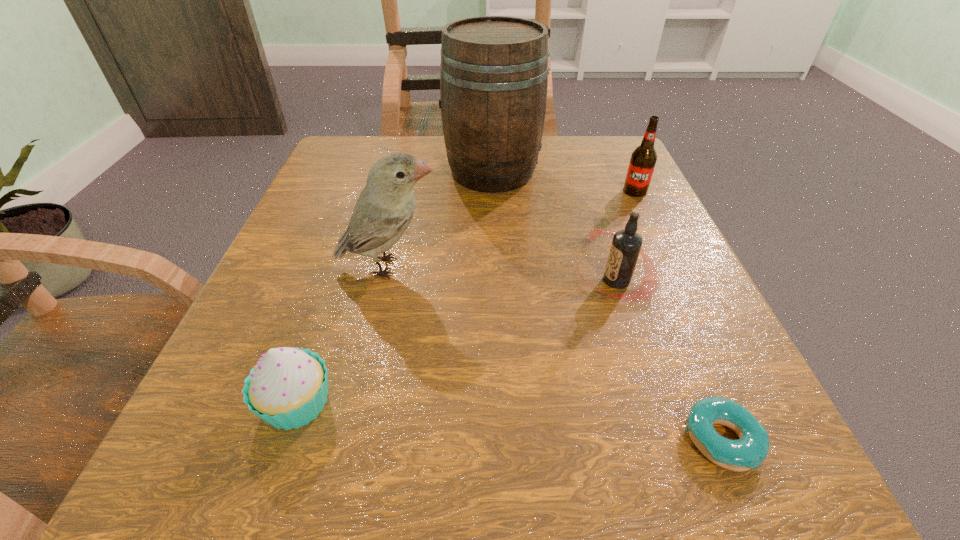
This screenshot has height=540, width=960. What are the coordinates of `free spot between the right root beer and the bird` in the screenshot? It's located at (512, 229).

At what (x,y) coordinates should I click in order to perform the action: click on vacant area that lies between the right root beer and the tallest object. Please return your answer as a coordinate pair (x, y). Looking at the image, I should click on (564, 181).

Identify the location of free spot between the second shortest object and the doughnut. This screenshot has width=960, height=540. (509, 421).

Locate an element on the screen. The image size is (960, 540). free space that is in between the fifth shortest object and the shortest object is located at coordinates (555, 353).

Select which object is the fifth closest to the left root beer. Please provide its 2D coordinates. Your answer should be formatted as a tuple, i.e. [(x, y)], where the tuple contains the x and y coordinates of a point satisfying the conditions above.

[(287, 388)]

Locate which object ranks second in proximity to the third shortest object. Please provide its 2D coordinates. Your answer should be formatted as a tuple, i.e. [(x, y)], where the tuple contains the x and y coordinates of a point satisfying the conditions above.

[(643, 159)]

At what (x,y) coordinates should I click in order to perform the action: click on vacant space that satisfies the following two spatial constraints: 1. on the front side of the shortest object; 2. on the left side of the fifth tallest object. Please return your answer as a coordinate pair (x, y). This screenshot has height=540, width=960. Looking at the image, I should click on (284, 440).

Find the location of `vacant point that satisfies the following two spatial constraints: 1. on the label of the doughnut; 2. on the left side of the shorter root beer`. vacant point that satisfies the following two spatial constraints: 1. on the label of the doughnut; 2. on the left side of the shorter root beer is located at coordinates (667, 440).

Identify the location of free space in the image that satisfies the following two spatial constraints: 1. on the back side of the doughnut; 2. on the label of the fourth tallest object. (654, 281).

The image size is (960, 540). Find the location of `free space in the image that satisfies the following two spatial constraints: 1. on the side of the cider near the bung hole; 2. on the back side of the shortest object`. free space in the image that satisfies the following two spatial constraints: 1. on the side of the cider near the bung hole; 2. on the back side of the shortest object is located at coordinates (502, 440).